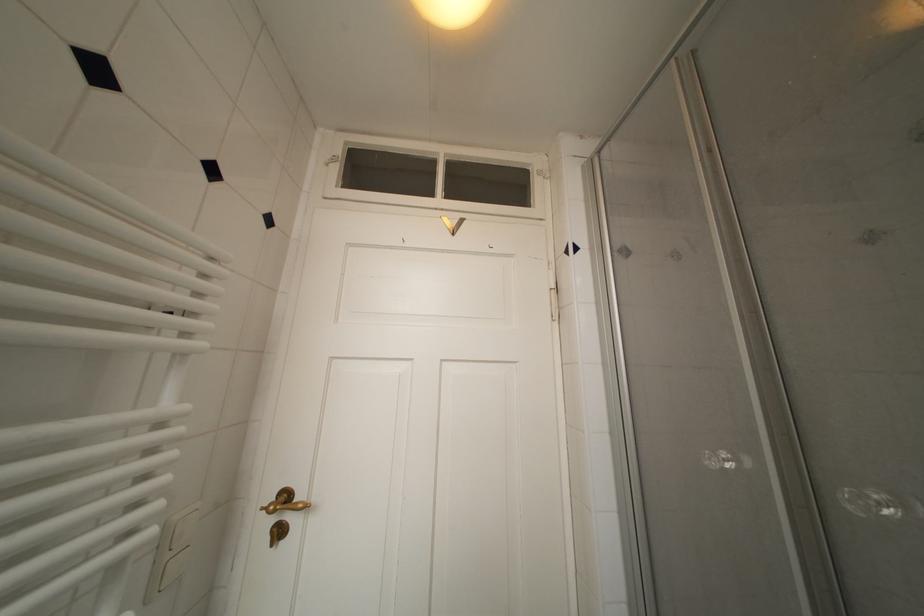
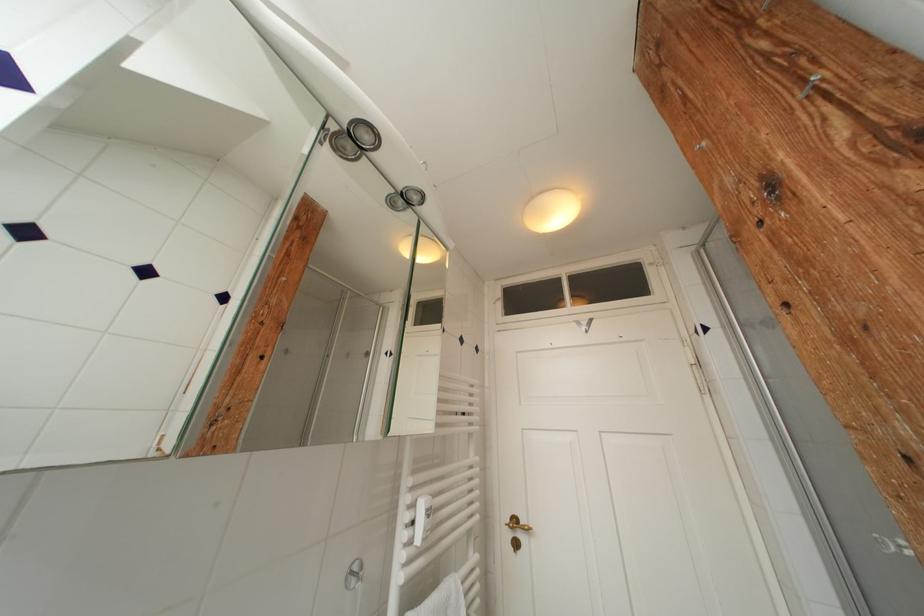
The point at (190, 337) is marked in the first image. Where is the corresponding point in the second image?

(478, 427)